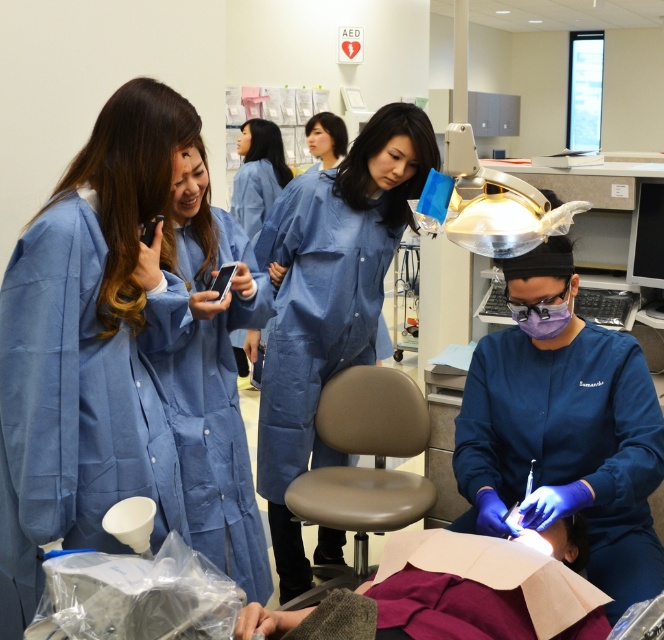
You are a dental student in the clinic and need to place both the blue fabric phone at center and the matte black phone at center on the same shelf. Which phone will occupy more vertical space on the shelf?

The blue fabric phone at center is much taller than the matte black phone at center, so it will occupy more vertical space on the shelf.

You are a patient in the dental clinic and need to locate the dental professional. Where is the blue fabric coat at center positioned relative to the dental light?

The blue fabric coat at center is located at point 0.470 on the x axis and 0.495 on the y axis, which is slightly to the left and below the dental light positioned above the patient.